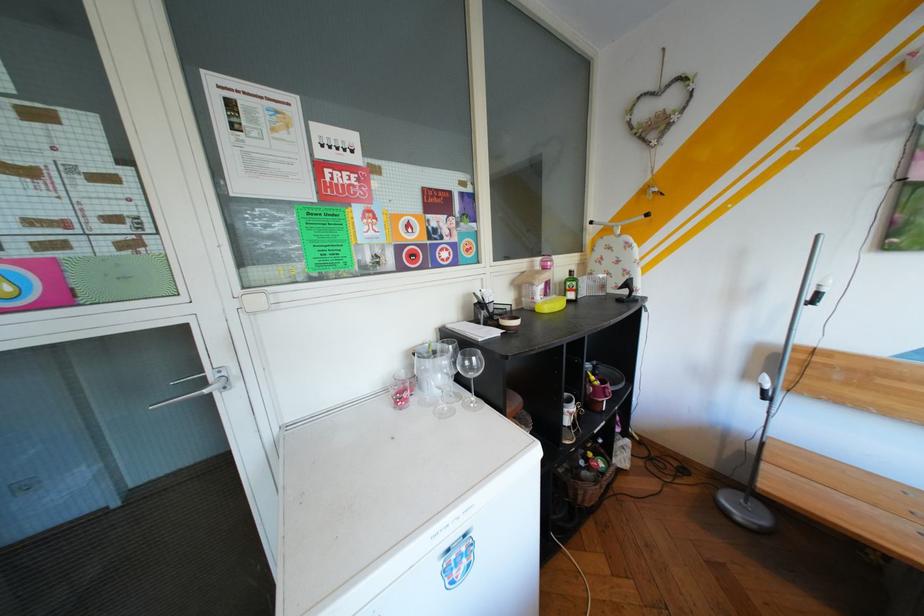
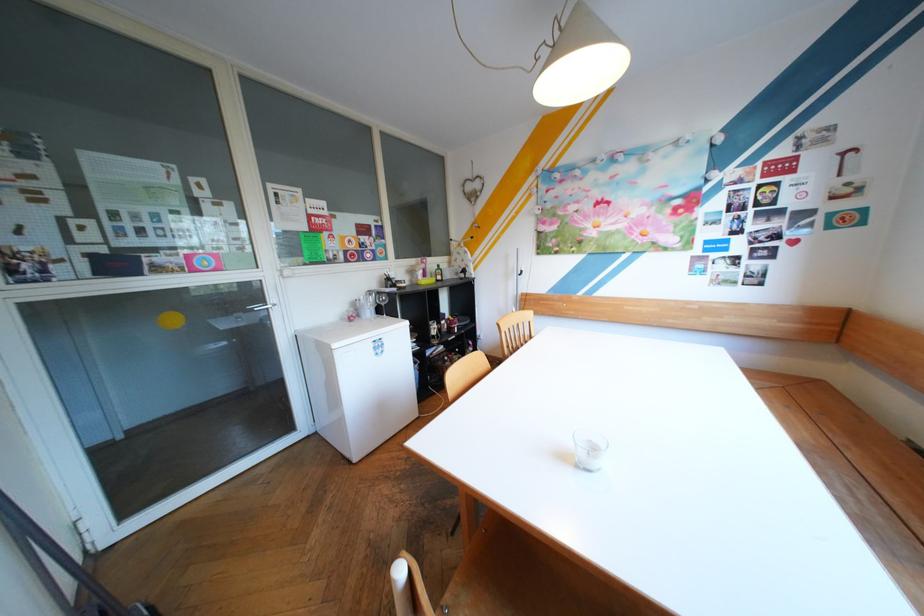
Question: I am providing you with two images of the same scene from different viewpoints. Which of the following objects are not visible in image2?

Choices:
 (A) light bottle
 (B) small black iron
 (C) black bag
 (D) silver door handle

Answer: (B)